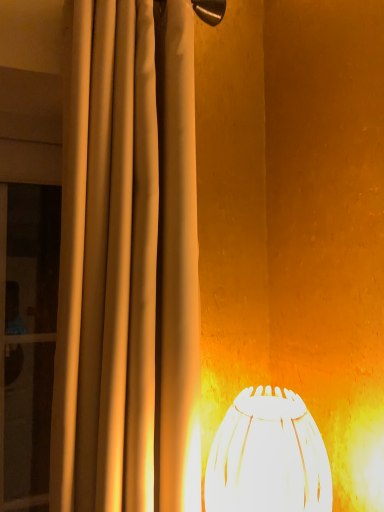
In order to face matte yellow curtain at left, should I rotate leftwards or rightwards?

To face it directly, rotate left by 14.375 degrees.

What do you see at coordinates (127, 266) in the screenshot? The image size is (384, 512). I see `matte yellow curtain at left` at bounding box center [127, 266].

The width and height of the screenshot is (384, 512). Identify the location of matte yellow curtain at left. (127, 266).

Measure the distance between matte yellow curtain at left and camera.

matte yellow curtain at left is 24.04 inches from camera.

You are a GUI agent. You are given a task and a screenshot of the screen. Output one action in this format:
    pyautogui.click(x=<x>, y=<y>)
    Task: Click on the matte yellow curtain at left
    
    Given the screenshot: What is the action you would take?
    pyautogui.click(x=127, y=266)